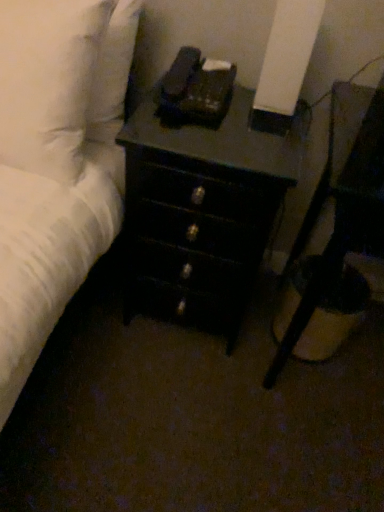
The width and height of the screenshot is (384, 512). I want to click on black wood chest of drawers at center, so click(200, 213).

Where is `black glossy nightstand at lower right`? black glossy nightstand at lower right is located at coordinates (345, 222).

Considering the relative positions of black wood chest of drawers at center and white soft pillow at upper left in the image provided, is black wood chest of drawers at center in front of white soft pillow at upper left?

No, black wood chest of drawers at center is behind white soft pillow at upper left.

Considering the sizes of black wood chest of drawers at center and white soft pillow at upper left in the image, is black wood chest of drawers at center wider or thinner than white soft pillow at upper left?

Clearly, black wood chest of drawers at center has more width compared to white soft pillow at upper left.

Between point (234, 205) and point (4, 28), which one is positioned behind?

The point (234, 205) is farther from the camera.

Considering the sizes of black wood chest of drawers at center and white soft pillow at upper left in the image, is black wood chest of drawers at center taller or shorter than white soft pillow at upper left?

Clearly, black wood chest of drawers at center is taller compared to white soft pillow at upper left.

How different are the orientations of black glossy nightstand at lower right and black wood chest of drawers at center in degrees?

1.14 degrees.

From the image's perspective, is black glossy nightstand at lower right above black wood chest of drawers at center?

No, from the image's perspective, black glossy nightstand at lower right is not above black wood chest of drawers at center.

Considering the sizes of objects black glossy nightstand at lower right and black wood chest of drawers at center in the image provided, who is smaller, black glossy nightstand at lower right or black wood chest of drawers at center?

black wood chest of drawers at center is smaller.

How far apart are black glossy nightstand at lower right and black wood chest of drawers at center?

They are 11.11 inches apart.

Is black wood chest of drawers at center aimed at black glossy nightstand at lower right?

No, black wood chest of drawers at center is not oriented towards black glossy nightstand at lower right.

Considering the sizes of objects black wood chest of drawers at center and black glossy nightstand at lower right in the image provided, who is shorter, black wood chest of drawers at center or black glossy nightstand at lower right?

black wood chest of drawers at center is shorter.

Which object is closer to the camera, black wood chest of drawers at center or black glossy nightstand at lower right?

black glossy nightstand at lower right is in front.

Image resolution: width=384 pixels, height=512 pixels. What are the coordinates of `the chest of drawers located underneath the black glossy nightstand at lower right (from a real-world perspective)` in the screenshot? It's located at (200, 213).

Which object is thinner, black glossy nightstand at lower right or white soft pillow at upper left?

Thinner between the two is white soft pillow at upper left.

From the image's perspective, between black glossy nightstand at lower right and white soft pillow at upper left, which one is located above?

white soft pillow at upper left appears higher in the image.

Which is behind, black glossy nightstand at lower right or white soft pillow at upper left?

white soft pillow at upper left is further away from the camera.

Would you say black glossy nightstand at lower right is a long distance from white soft pillow at upper left?

No, black glossy nightstand at lower right is not far away from white soft pillow at upper left.

Which of these two, white soft pillow at upper left or black glossy nightstand at lower right, is bigger?

black glossy nightstand at lower right is bigger.

From a real-world perspective, between white soft pillow at upper left and black glossy nightstand at lower right, who is vertically higher?

In real-world perspective, white soft pillow at upper left is above.

Based on the photo, which of these two, white soft pillow at upper left or black glossy nightstand at lower right, is wider?

Wider between the two is black glossy nightstand at lower right.

From the image's perspective, is white soft pillow at upper left beneath black glossy nightstand at lower right?

Incorrect, from the image's perspective, white soft pillow at upper left is higher than black glossy nightstand at lower right.

Who is taller, white soft pillow at upper left or black wood chest of drawers at center?

black wood chest of drawers at center is taller.

Is white soft pillow at upper left wider or thinner than black wood chest of drawers at center?

Clearly, white soft pillow at upper left has less width compared to black wood chest of drawers at center.

Which object is closer to the camera, white soft pillow at upper left or black wood chest of drawers at center?

white soft pillow at upper left is more forward.

Identify the location of pillow that is above the black wood chest of drawers at center (from a real-world perspective). Image resolution: width=384 pixels, height=512 pixels. (48, 81).

Where is `nightstand to the right of black wood chest of drawers at center`? The height and width of the screenshot is (512, 384). nightstand to the right of black wood chest of drawers at center is located at coordinates (345, 222).

Considering their positions, is black wood chest of drawers at center positioned closer to white soft pillow at upper left than black glossy nightstand at lower right?

The object closer to white soft pillow at upper left is black wood chest of drawers at center.

Looking at the image, which one is located closer to black wood chest of drawers at center, white soft pillow at upper left or black glossy nightstand at lower right?

black glossy nightstand at lower right is positioned closer to the anchor black wood chest of drawers at center.

Considering their positions, is black glossy nightstand at lower right positioned further to black wood chest of drawers at center than white soft pillow at upper left?

Based on the image, white soft pillow at upper left appears to be further to black wood chest of drawers at center.

From the image, which object appears to be farther from black glossy nightstand at lower right, black wood chest of drawers at center or white soft pillow at upper left?

white soft pillow at upper left lies further to black glossy nightstand at lower right than the other object.

Based on their spatial positions, is black glossy nightstand at lower right or black wood chest of drawers at center closer to white soft pillow at upper left?

Among the two, black wood chest of drawers at center is located nearer to white soft pillow at upper left.

From the picture: Based on their spatial positions, is white soft pillow at upper left or black wood chest of drawers at center closer to black glossy nightstand at lower right?

Among the two, black wood chest of drawers at center is located nearer to black glossy nightstand at lower right.

The width and height of the screenshot is (384, 512). Identify the location of chest of drawers between white soft pillow at upper left and black glossy nightstand at lower right. (200, 213).